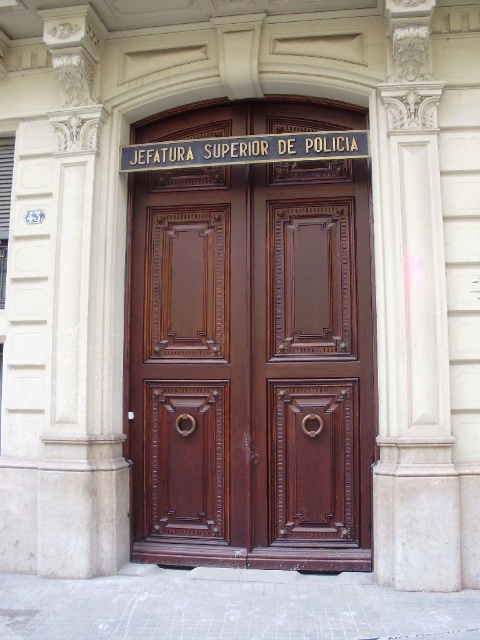
Does brown polished wood door at center appear on the right side of gold metallic sign at center?

Yes, brown polished wood door at center is to the right of gold metallic sign at center.

Which is below, brown polished wood door at center or gold metallic sign at center?

brown polished wood door at center

Find the location of a particular element. The width and height of the screenshot is (480, 640). brown polished wood door at center is located at coordinates (252, 365).

Is point (298, 467) closer to camera compared to point (392, 218)?

That is False.

Who is higher up, brown polished wood door at center or white marble pillar at upper right?

white marble pillar at upper right

Find the location of a particular element. This screenshot has height=640, width=480. brown polished wood door at center is located at coordinates (252, 365).

Which is behind, point (429, 353) or point (300, 134)?

Point (300, 134)

This screenshot has height=640, width=480. What do you see at coordinates (411, 321) in the screenshot? I see `white marble pillar at upper right` at bounding box center [411, 321].

Is point (435, 278) in front of point (140, 161)?

That is True.

Locate an element on the screen. Image resolution: width=480 pixels, height=640 pixels. white marble pillar at upper right is located at coordinates (411, 321).